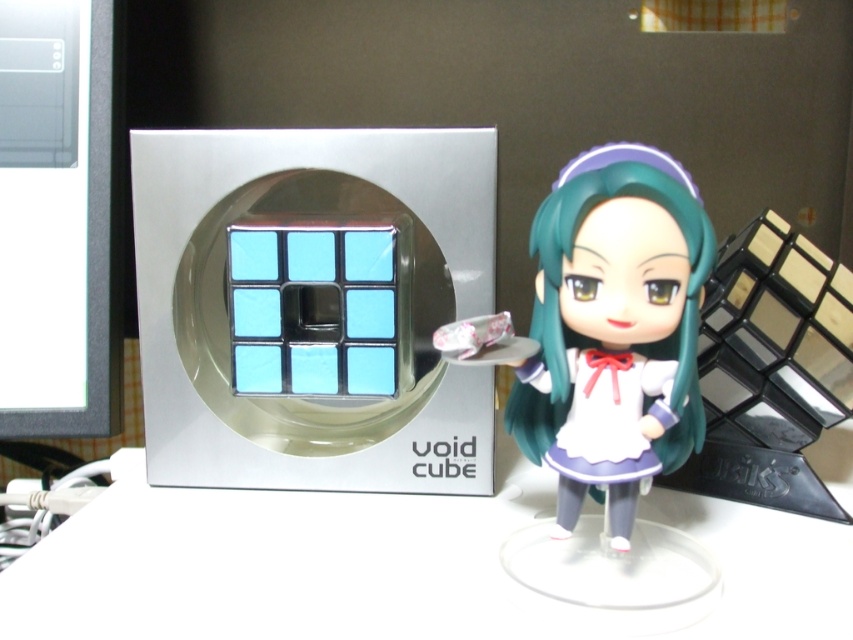
You are organizing a display for a puzzle shop and need to place both the white glossy table at center and the green matte hair at center on a shelf. Given their sizes, which object should you place first to ensure stability?

The white glossy table at center has a larger size compared to the green matte hair at center, so you should place the white glossy table at center first to ensure stability.

You are arranging a display for a puzzle store. You have a white glossy table at center and a green matte hair at center. Which object should you place first if you want to ensure there is enough space for both?

The white glossy table at center has a larger width than the green matte hair at center, so you should place the white glossy table at center first to ensure there is enough space for both.